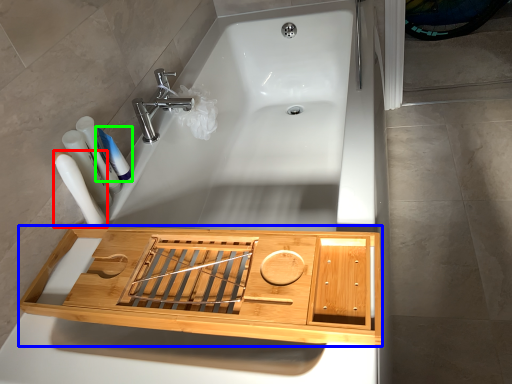
Question: Which object is the farthest from toiletry (highlighted by a red box)? Choose among these: cabinetry (highlighted by a blue box) or toothpaste (highlighted by a green box).

Choices:
 (A) cabinetry
 (B) toothpaste

Answer: (A)